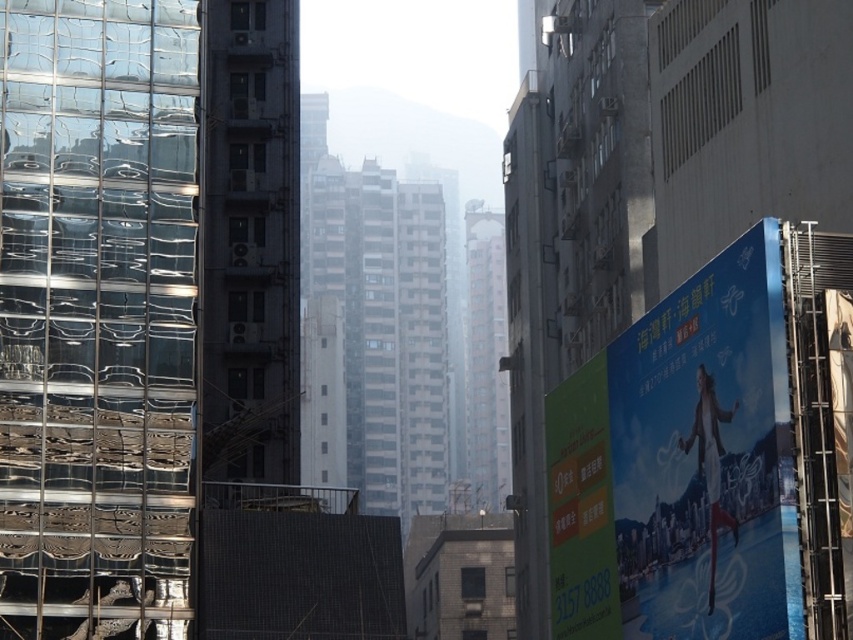
You are standing at the point labeled point at [97,256]. You want to walk to the nearest building entrance. The nearest building entrance is 216.75 feet away from your current position. If you walk at a speed of 3 feet per second, how many seconds will it take you to reach the entrance?

The nearest building entrance is 216.75 feet away from your current position, and walking at 3 feet per second, it will take 216.75 divided by 3 equals 72.25 seconds. So approximately 72.25 seconds.

You are a city planner reviewing the urban layout. You notice the transparent glass scaffolding at left and the blue glossy billboard at right. Which object is closer to the observer in the scene?

The transparent glass scaffolding at left is closer to the observer because the blue glossy billboard at right is positioned behind it.